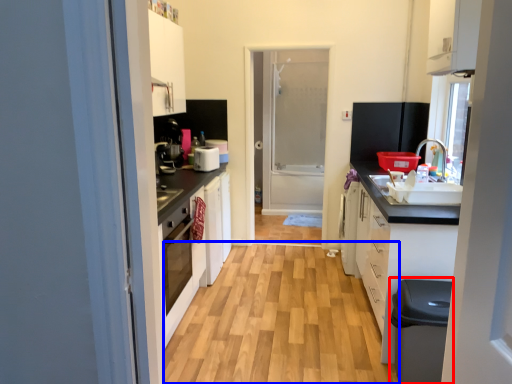
Question: Which point is closer to the camera, dish washer (highlighted by a red box) or plain (highlighted by a blue box)?

Choices:
 (A) dish washer
 (B) plain

Answer: (A)